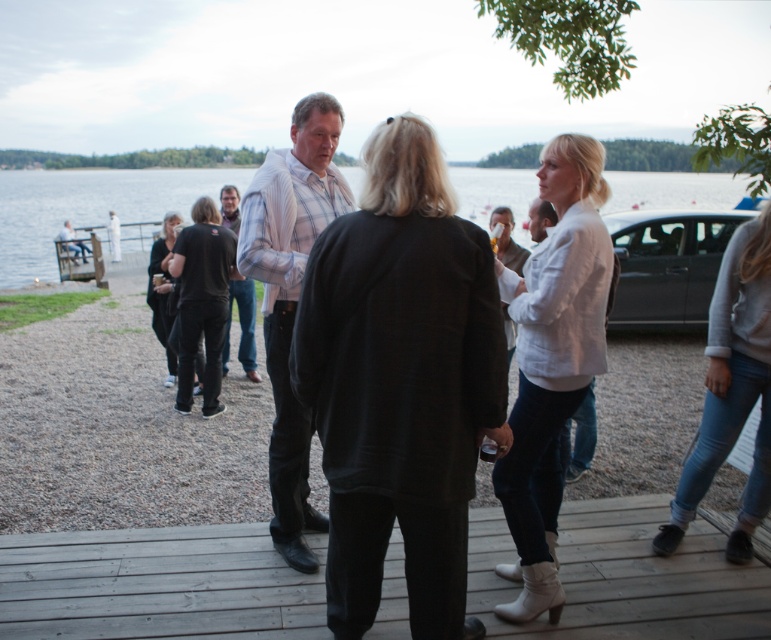
Question: In this image, where is transparent water at center located relative to denim jeans at lower right?

Choices:
 (A) below
 (B) above

Answer: (B)

Question: Which point appears closest to the camera in this image?

Choices:
 (A) (135, 228)
 (B) (335, 602)
 (C) (163, 580)
 (D) (615, 227)

Answer: (B)

Question: Can you confirm if light gray striped shirt at center is positioned above denim jeans at lower right?

Choices:
 (A) no
 (B) yes

Answer: (B)

Question: Which of these objects is positioned farthest from the black leather jacket at center?

Choices:
 (A) wooden at center
 (B) denim jeans at lower right

Answer: (B)

Question: Is white leather boots at center further to the viewer compared to black leather jacket at center?

Choices:
 (A) yes
 (B) no

Answer: (B)

Question: Among these objects, which one is farthest from the camera?

Choices:
 (A) light gray striped shirt at center
 (B) white leather boots at center
 (C) transparent water at center

Answer: (A)